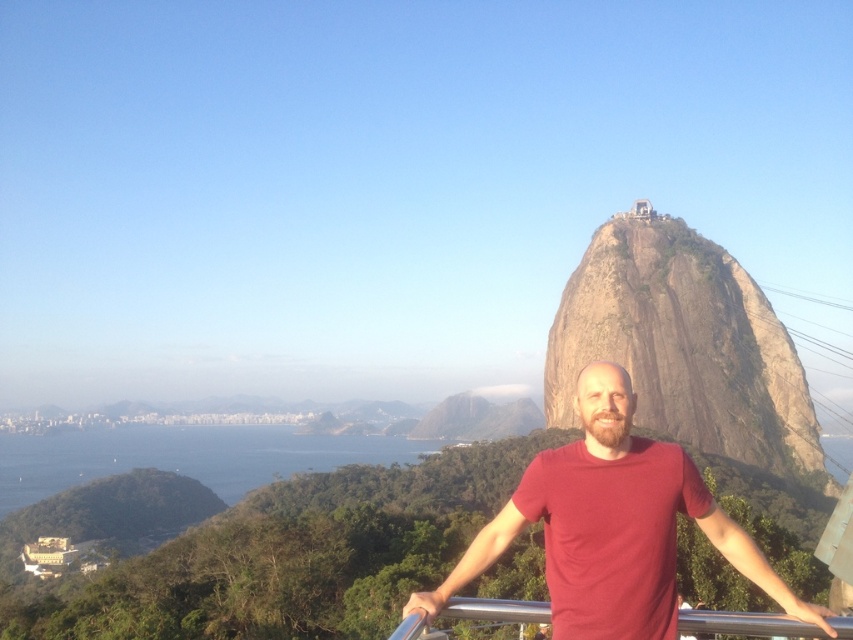
Looking at this image, who is positioned more to the left, rocky brown at center or silver metallic rail at center?

silver metallic rail at center

Which is behind, point (737, 362) or point (738, 632)?

The point (737, 362) is behind.

Identify the location of rocky brown at center. (683, 346).

Between point (651, 276) and point (602, 410), which one is positioned in front?

Positioned in front is point (602, 410).

Is rocky brown at center in front of red matte t-shirt at center?

No, rocky brown at center is behind red matte t-shirt at center.

Does point (822, 454) come closer to viewer compared to point (578, 448)?

No, (822, 454) is further to viewer.

Identify the location of rocky brown at center. (683, 346).

Between red matte t-shirt at center and silver metallic rail at center, which one is positioned lower?

silver metallic rail at center

Is red matte t-shirt at center below silver metallic rail at center?

No, red matte t-shirt at center is not below silver metallic rail at center.

In the scene shown: Who is more forward, [578,376] or [543,602]?

Positioned in front is point [543,602].

You are a GUI agent. You are given a task and a screenshot of the screen. Output one action in this format:
    pyautogui.click(x=<x>, y=<y>)
    Task: Click on the red matte t-shirt at center
    
    Given the screenshot: What is the action you would take?
    pyautogui.click(x=613, y=525)